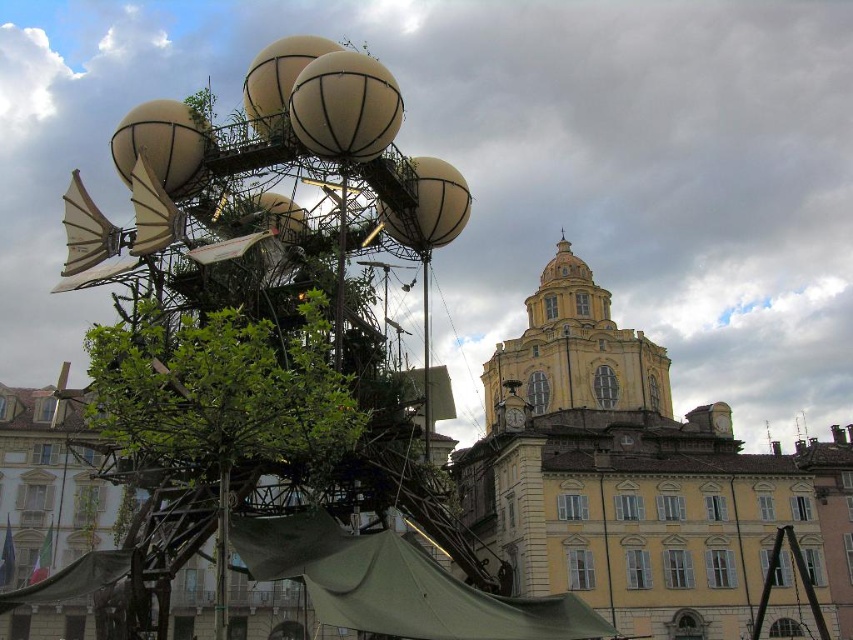
Question: Estimate the real-world distances between objects in this image. Which object is farther from the green canvas canopy at lower center?

Choices:
 (A) yellow matte tower at upper center
 (B) green leafy tree at center

Answer: (A)

Question: Does green leafy tree at center appear on the right side of green canvas canopy at lower center?

Choices:
 (A) yes
 (B) no

Answer: (B)

Question: Observing the image, what is the correct spatial positioning of green canvas canopy at lower center in reference to green canvas canopy at lower left?

Choices:
 (A) left
 (B) right

Answer: (B)

Question: Which of the following is the farthest from the observer?

Choices:
 (A) (335, 605)
 (B) (238, 360)
 (C) (564, 397)

Answer: (C)

Question: Does yellow matte tower at upper center lie behind green canvas canopy at lower left?

Choices:
 (A) no
 (B) yes

Answer: (B)

Question: Which point is closer to the camera taking this photo?

Choices:
 (A) (115, 352)
 (B) (598, 349)
 (C) (85, 557)

Answer: (A)